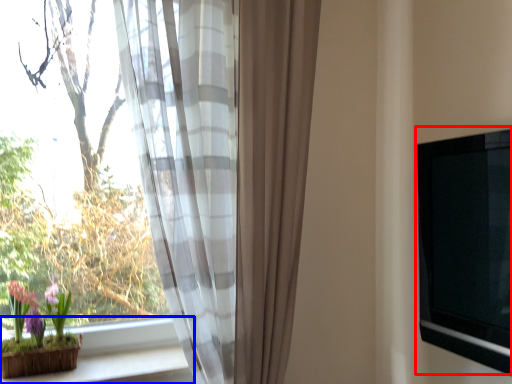
Question: Which point is closer to the camera, window screen (highlighted by a red box) or window sill (highlighted by a blue box)?

Choices:
 (A) window screen
 (B) window sill

Answer: (A)